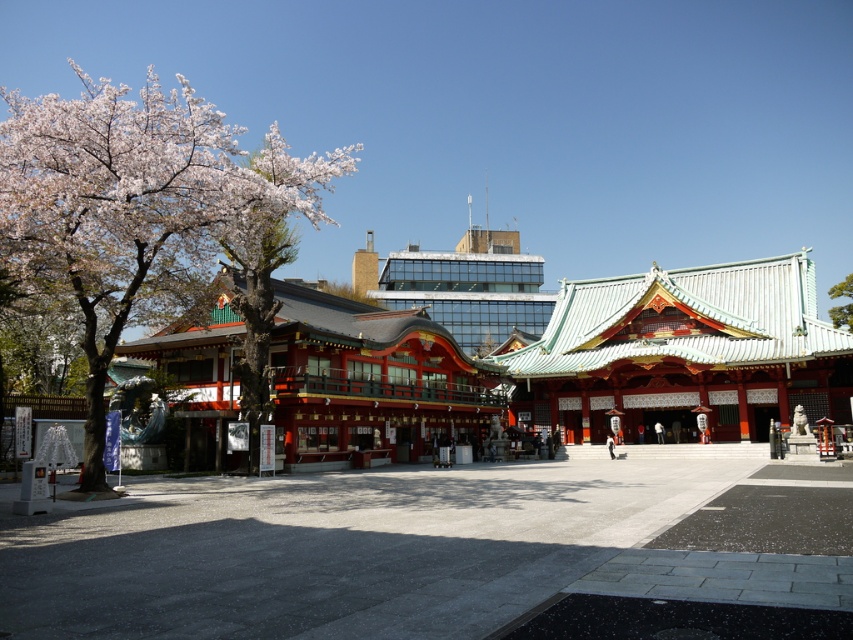
Can you confirm if smooth bark tree at left is smaller than green leafy tree at upper center?

No, smooth bark tree at left is not smaller than green leafy tree at upper center.

Does point (102, 168) come in front of point (845, 320)?

Yes.

The width and height of the screenshot is (853, 640). Identify the location of smooth bark tree at left. (109, 202).